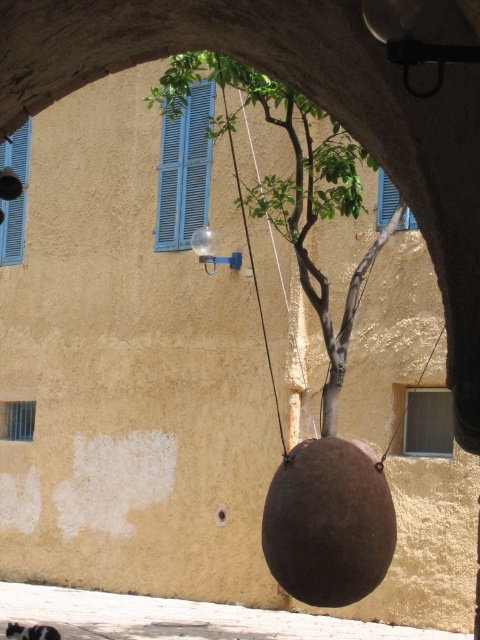
Does blue painted wood shutter at upper left have a larger size compared to blue wooden shutter at upper center?

No.

Between blue painted wood shutter at upper left and blue wooden shutter at upper center, which one has more height?

Standing taller between the two is blue painted wood shutter at upper left.

Is point (414, 413) positioned after point (381, 182)?

No.

The width and height of the screenshot is (480, 640). I want to click on blue painted wood shutter at upper left, so click(428, 422).

Between point (437, 424) and point (14, 250), which one is positioned behind?

Point (14, 250)

Does blue painted wood shutter at upper left appear over blue wooden shutter at left?

Incorrect, blue painted wood shutter at upper left is not positioned above blue wooden shutter at left.

You are a GUI agent. You are given a task and a screenshot of the screen. Output one action in this format:
    pyautogui.click(x=<x>, y=<y>)
    Task: Click on the blue painted wood shutter at upper left
    Image resolution: width=480 pixels, height=640 pixels.
    Given the screenshot: What is the action you would take?
    pyautogui.click(x=428, y=422)

Does brown matte pot at lower center come behind blue wooden shutter at left?

No.

What do you see at coordinates (180, 618) in the screenshot? I see `brown matte pot at lower center` at bounding box center [180, 618].

The width and height of the screenshot is (480, 640). What do you see at coordinates (180, 618) in the screenshot?
I see `brown matte pot at lower center` at bounding box center [180, 618].

Find the location of `brown matte pot at lower center`. brown matte pot at lower center is located at coordinates (180, 618).